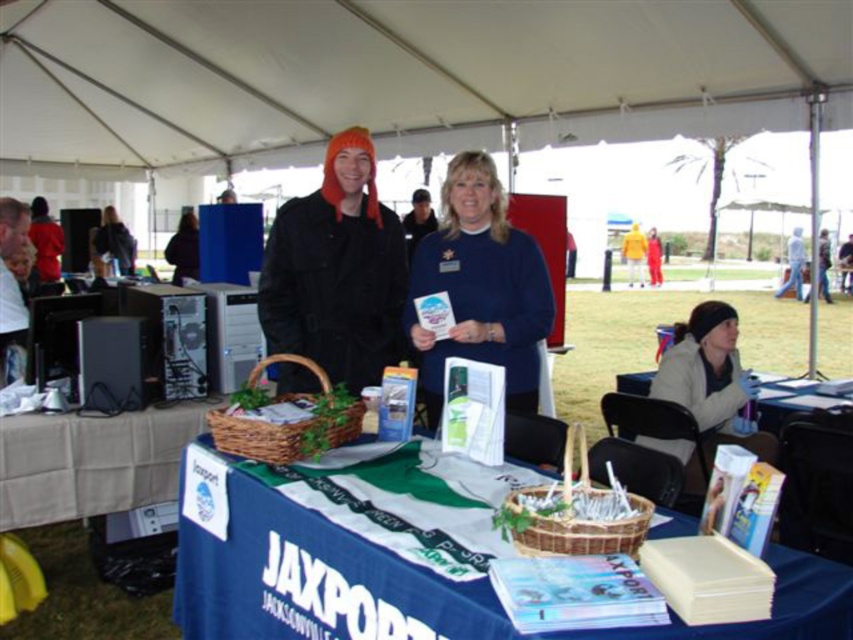
You are organizing a booth at the JAXPORT table and need to place the blue fleece sweater at center and the beige fleece jacket at lower right on a shelf. If the shelf can only hold items up to 30 cm in width, which item might not fit and why?

The beige fleece jacket at lower right has a greater width than the blue fleece sweater at center. Since the shelf can only hold items up to 30 cm, the beige fleece jacket at lower right might not fit if its width exceeds 30 cm.

You are a participant at the fair and need to pick up an item from the white cardboard box at center and then hand over a jacket to the organizer at the yellow fabric jacket at center. Can you walk directly between these two items without needing to detour around any obstacles?

The white cardboard box at center and yellow fabric jacket at center are 16.09 meters apart, so you can walk directly between them without needing to detour around any obstacles since there is enough space between them.